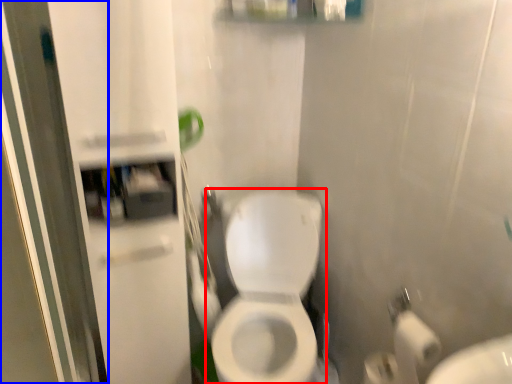
Question: Which point is further to the camera, toilet (highlighted by a red box) or screen door (highlighted by a blue box)?

Choices:
 (A) toilet
 (B) screen door

Answer: (A)